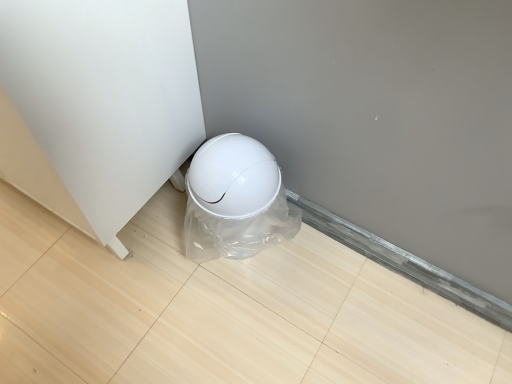
Identify the location of free point in front of white glossy waste container at lower left. (228, 301).